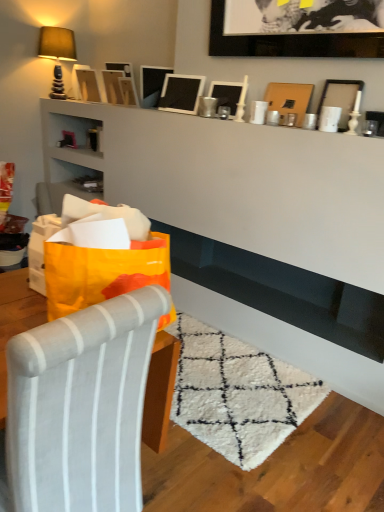
Question: Considering their positions, is wooden picture frame at upper center, the third picture frame when ordered from left to right, located in front of or behind matte black picture frame at upper left, which ranks as the eighth picture frame in right-to-left order?

Choices:
 (A) front
 (B) behind

Answer: (A)

Question: From a real-world perspective, relative to matte black picture frame at upper left, which ranks as the eighth picture frame in right-to-left order, is wooden picture frame at upper center, the 6th picture frame viewed from the right, vertically above or below?

Choices:
 (A) above
 (B) below

Answer: (B)

Question: Which of these objects is positioned closest to the matte black picture frame at upper left, which is the 1th picture frame in left-to-right order?

Choices:
 (A) metallic silver picture frame at upper center, positioned as the 3th picture frame in right-to-left order
 (B) black matte picture frame at upper center, the seventh picture frame in the left-to-right sequence
 (C) matte beige fabric at upper left
 (D) matte black picture frame at upper center, acting as the 4th picture frame starting from the left
 (E) wooden picture frame at upper center, the seventh picture frame in the right-to-left sequence

Answer: (E)

Question: Which is farther from the matte brown picture frame at upper right, arranged as the 1th picture frame when viewed from the right?

Choices:
 (A) orange paper bag at left
 (B) metallic silver picture frame at upper center, positioned as the 3th picture frame in right-to-left order
 (C) matte black picture frame at upper left, which ranks as the eighth picture frame in right-to-left order
 (D) matte black picture frame at upper center, which is the 5th picture frame in left-to-right order
 (E) wooden picture frame at upper center, the seventh picture frame in the right-to-left sequence

Answer: (C)